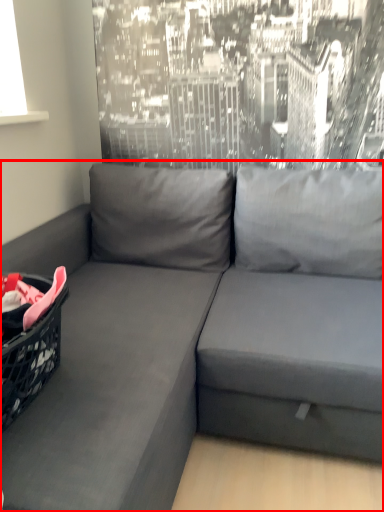
Question: From the image's perspective, where is studio couch (annotated by the red box) located relative to basket?

Choices:
 (A) above
 (B) below

Answer: (B)